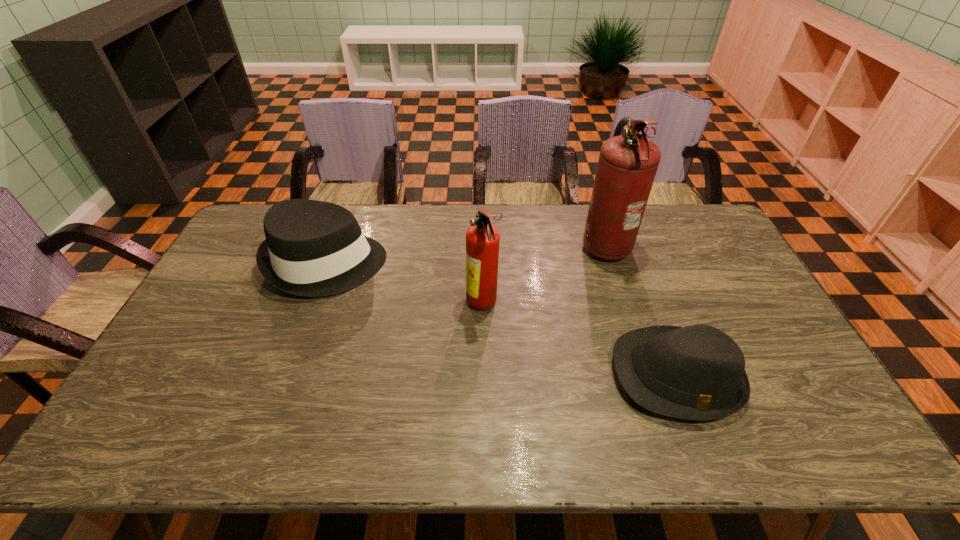
Locate an element on the screen. free location located at the front of the tallest object where the nozzle is aimed is located at coordinates (517, 243).

This screenshot has height=540, width=960. What are the coordinates of `blank space located on the front-facing side of the second object from left to right` in the screenshot? It's located at (360, 305).

Locate an element on the screen. The image size is (960, 540). vacant space located 0.220m on the front-facing side of the second object from left to right is located at coordinates (394, 305).

This screenshot has height=540, width=960. I want to click on free space located 0.080m on the front-facing side of the second object from left to right, so click(440, 305).

This screenshot has height=540, width=960. In order to click on blank space located 0.060m on the right of the farther fedora in this screenshot , I will do `click(403, 264)`.

At what (x,y) coordinates should I click in order to perform the action: click on fire extinguisher that is at the far edge. Please return your answer as a coordinate pair (x, y). This screenshot has width=960, height=540. Looking at the image, I should click on (627, 165).

The image size is (960, 540). I want to click on fedora that is at the far edge, so click(x=313, y=248).

Find the location of a particular element. object positioned at the near edge is located at coordinates (697, 372).

Where is `object positioned at the left edge`? The width and height of the screenshot is (960, 540). object positioned at the left edge is located at coordinates (313, 248).

You are a GUI agent. You are given a task and a screenshot of the screen. Output one action in this format:
    pyautogui.click(x=<x>, y=<y>)
    Task: Click on the object that is at the far left corner
    The width and height of the screenshot is (960, 540).
    Given the screenshot: What is the action you would take?
    pyautogui.click(x=313, y=248)